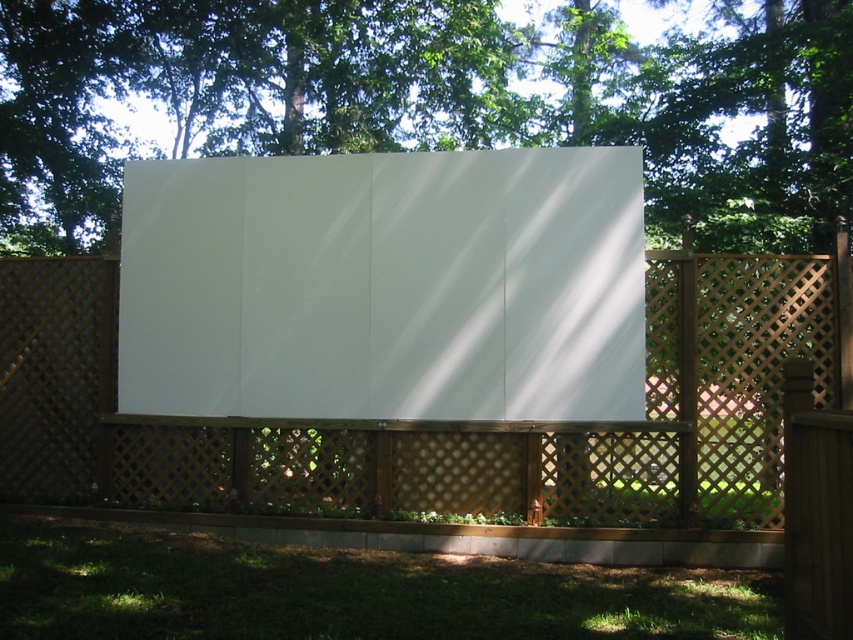
Question: Which of the following is the closest to the observer?

Choices:
 (A) (508, 145)
 (B) (821, 385)
 (C) (128, 259)

Answer: (B)

Question: Does white matte billboard at center appear under wooden lattice fence at center?

Choices:
 (A) yes
 (B) no

Answer: (B)

Question: Among these points, which one is farthest from the camera?

Choices:
 (A) (577, 216)
 (B) (732, 156)

Answer: (B)

Question: Which is farther from the green leafy tree at upper center?

Choices:
 (A) white matte billboard at center
 (B) wooden lattice fence at center

Answer: (B)

Question: Can you confirm if white matte billboard at center is smaller than wooden lattice fence at center?

Choices:
 (A) yes
 (B) no

Answer: (B)

Question: Is green leafy tree at upper center wider than white matte billboard at center?

Choices:
 (A) no
 (B) yes

Answer: (B)